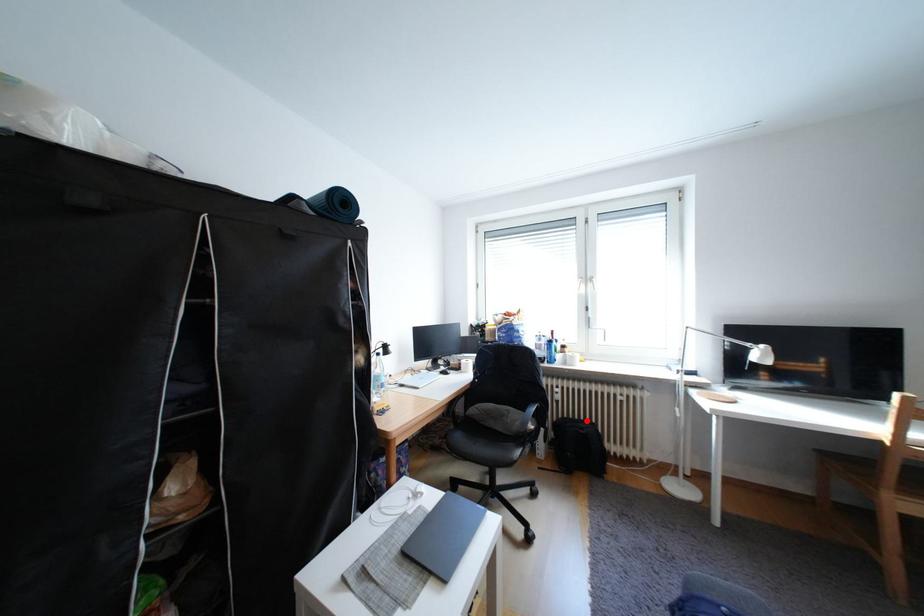
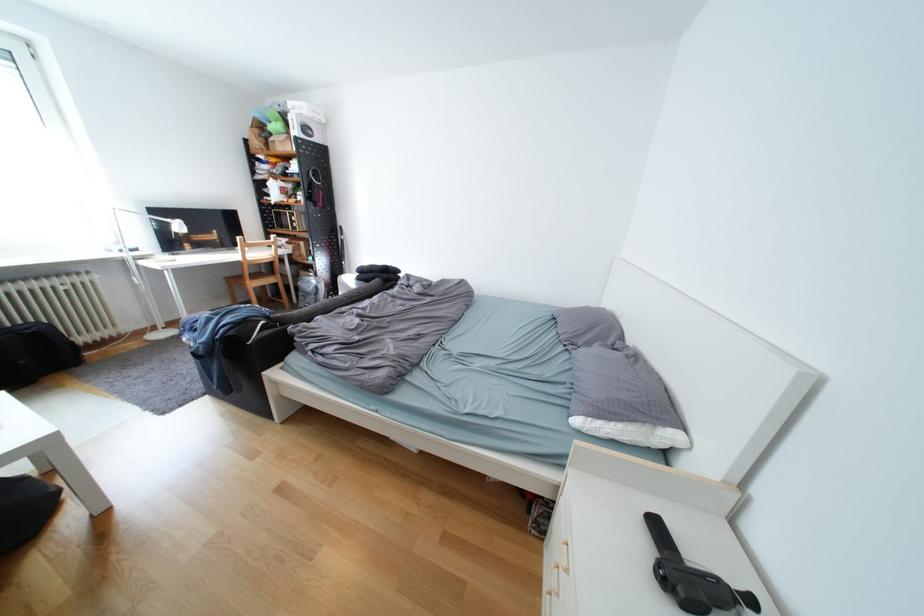
The point at the highlighted location is marked in the first image. Where is the corresponding point in the second image?

(14, 330)